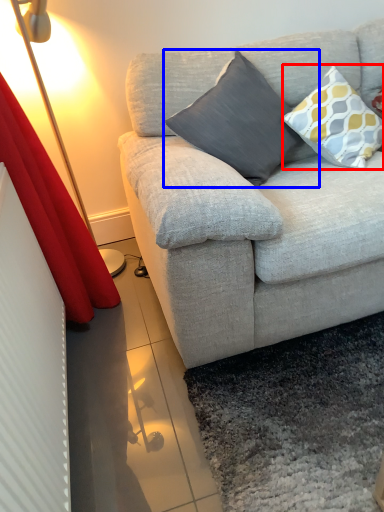
Question: Among these objects, which one is farthest to the camera, pillow (highlighted by a red box) or pillow (highlighted by a blue box)?

Choices:
 (A) pillow
 (B) pillow

Answer: (A)